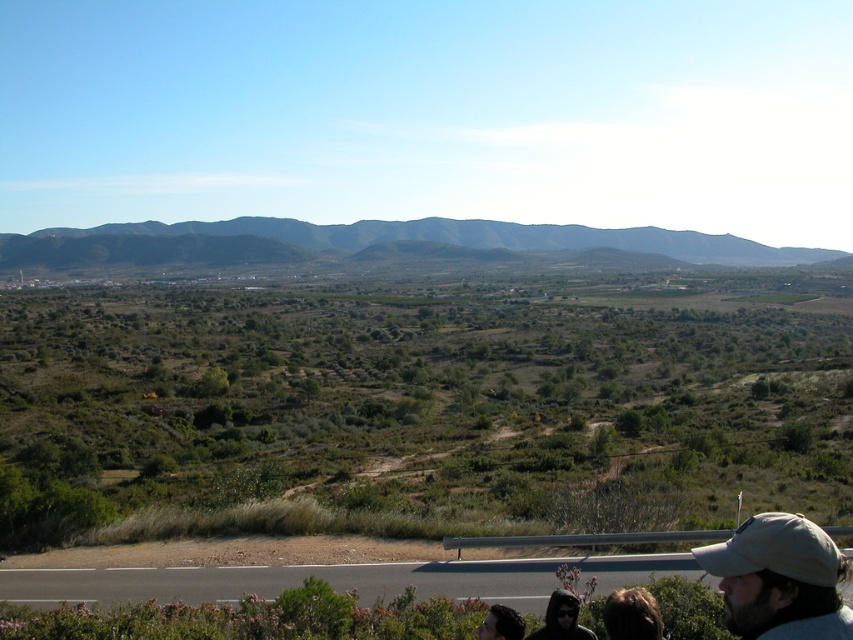
Question: Can you confirm if green shrubbery at center is thinner than dark green textured mountains at upper center?

Choices:
 (A) no
 (B) yes

Answer: (B)

Question: Can you confirm if green shrubbery at center is positioned to the right of beige fabric cap at lower right?

Choices:
 (A) yes
 (B) no

Answer: (B)

Question: Which of the following is the farthest from the observer?

Choices:
 (A) dark green textured mountains at upper center
 (B) beige fabric cap at lower right
 (C) asphalt road at lower center
 (D) green shrubbery at center

Answer: (A)

Question: Does dark green textured mountains at upper center appear over beige fabric cap at lower right?

Choices:
 (A) no
 (B) yes

Answer: (B)

Question: Which of the following is the farthest from the observer?

Choices:
 (A) dark green textured mountains at upper center
 (B) green shrubbery at center

Answer: (A)

Question: Among these points, which one is nearest to the camera?

Choices:
 (A) click(248, 593)
 (B) click(587, 371)

Answer: (A)